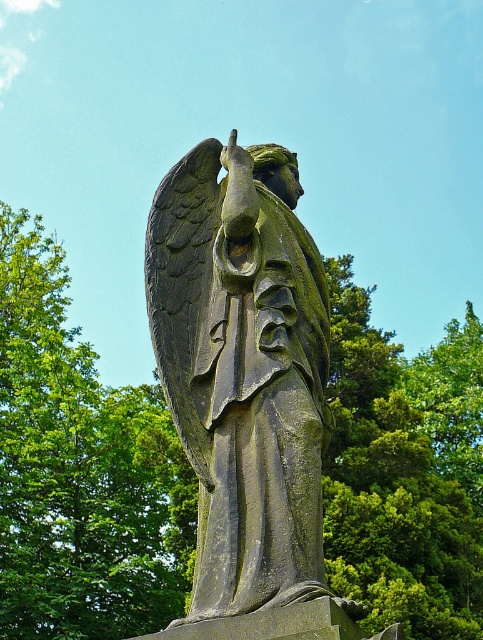
Is green leafy tree at center above greenish stone statue at center?

Incorrect, green leafy tree at center is not positioned above greenish stone statue at center.

What do you see at coordinates (81, 468) in the screenshot? I see `green leafy tree at center` at bounding box center [81, 468].

Does point (443, 509) come in front of point (299, 289)?

No, it is behind (299, 289).

Find the location of a particular element. Image resolution: width=483 pixels, height=640 pixels. green leafy tree at center is located at coordinates (81, 468).